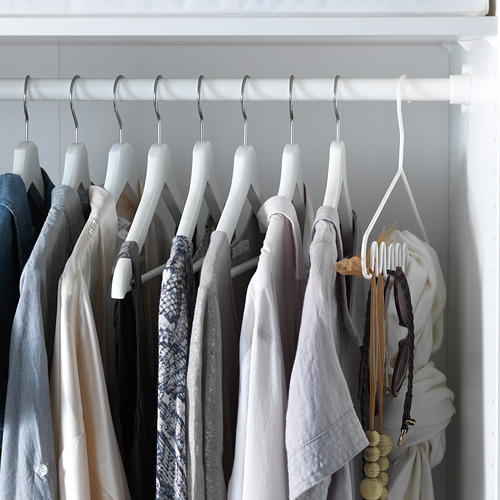
At what (x,y) coordinates should I click in order to perform the action: click on clothes hangers. Please return your answer as a coordinate pair (x, y). The image size is (500, 500). Looking at the image, I should click on (23, 161), (76, 161), (116, 166), (161, 166), (201, 166), (240, 169), (290, 172), (334, 169), (401, 169).